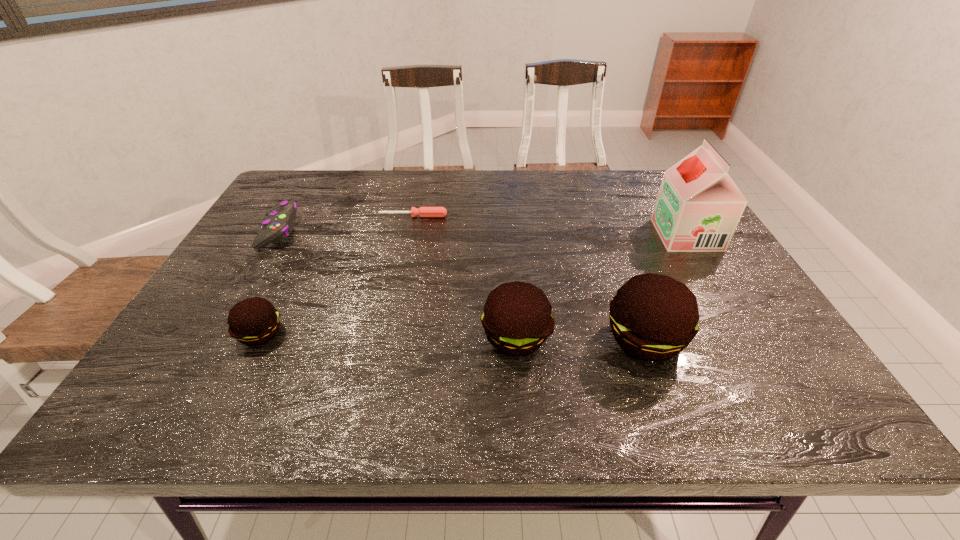
This screenshot has height=540, width=960. Identify the location of patty object that ranks as the second closest to the third tallest object. (254, 321).

Image resolution: width=960 pixels, height=540 pixels. In order to click on patty that stands as the closest to the soya milk in this screenshot , I will do `click(653, 317)`.

At what (x,y) coordinates should I click in order to perform the action: click on blank space that satisfies the following two spatial constraints: 1. on the front side of the shortest object; 2. on the right side of the third object from right to left. Please return your answer as a coordinate pair (x, y). The image size is (960, 540). Looking at the image, I should click on (389, 337).

Where is `free region that satisfies the following two spatial constraints: 1. on the back side of the fourth object from right to left; 2. on the left side of the fourth tallest object`? The width and height of the screenshot is (960, 540). free region that satisfies the following two spatial constraints: 1. on the back side of the fourth object from right to left; 2. on the left side of the fourth tallest object is located at coordinates (319, 216).

This screenshot has height=540, width=960. What are the coordinates of `vacant space that satisfies the following two spatial constraints: 1. on the front side of the screwdriver; 2. on the left side of the fourth shortest object` in the screenshot? It's located at (389, 337).

The width and height of the screenshot is (960, 540). In order to click on vacant region that satisfies the following two spatial constraints: 1. on the front side of the second object from right to left; 2. on the left side of the control in this screenshot , I will do `click(214, 339)`.

At what (x,y) coordinates should I click in order to perform the action: click on free spot that satisfies the following two spatial constraints: 1. on the front side of the second tallest patty; 2. on the right side of the second object from right to left. Please return your answer as a coordinate pair (x, y). This screenshot has width=960, height=540. Looking at the image, I should click on (516, 339).